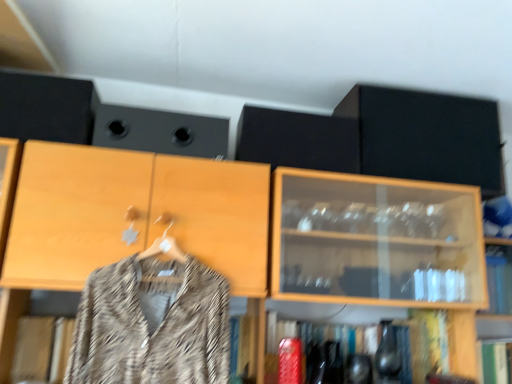
Question: Does black matte cabinet at upper right have a greater width compared to patterned fabric coat at center?

Choices:
 (A) yes
 (B) no

Answer: (A)

Question: Considering the relative sizes of black matte cabinet at upper right and patterned fabric coat at center in the image provided, is black matte cabinet at upper right shorter than patterned fabric coat at center?

Choices:
 (A) no
 (B) yes

Answer: (B)

Question: Is black matte cabinet at upper right not within patterned fabric coat at center?

Choices:
 (A) no
 (B) yes

Answer: (B)

Question: Is black matte cabinet at upper right further to the viewer compared to patterned fabric coat at center?

Choices:
 (A) yes
 (B) no

Answer: (A)

Question: Could you tell me if black matte cabinet at upper right is facing patterned fabric coat at center?

Choices:
 (A) no
 (B) yes

Answer: (A)

Question: Is black matte cabinet at upper right positioned in front of patterned fabric coat at center?

Choices:
 (A) no
 (B) yes

Answer: (A)

Question: From the image's perspective, does black matte speaker at upper center, which appears as the 2th speaker when viewed from the left, appear higher than shiny metallic vase at lower center?

Choices:
 (A) yes
 (B) no

Answer: (A)

Question: From a real-world perspective, is black matte speaker at upper center, positioned as the first speaker in right-to-left order, physically below shiny metallic vase at lower center?

Choices:
 (A) no
 (B) yes

Answer: (A)

Question: Can you confirm if black matte speaker at upper center, positioned as the first speaker in right-to-left order, is thinner than shiny metallic vase at lower center?

Choices:
 (A) yes
 (B) no

Answer: (A)

Question: Is black matte speaker at upper center, which appears as the 2th speaker when viewed from the left, at the right side of shiny metallic vase at lower center?

Choices:
 (A) no
 (B) yes

Answer: (A)

Question: Is black matte speaker at upper center, which appears as the 2th speaker when viewed from the left, not close to shiny metallic vase at lower center?

Choices:
 (A) yes
 (B) no

Answer: (B)

Question: From a real-world perspective, is black matte speaker at upper center, which appears as the 2th speaker when viewed from the left, located higher than shiny metallic vase at lower center?

Choices:
 (A) yes
 (B) no

Answer: (A)

Question: Is shiny metallic vase at lower center not inside black matte speaker at upper center, which appears as the 2th speaker when viewed from the left?

Choices:
 (A) no
 (B) yes

Answer: (B)